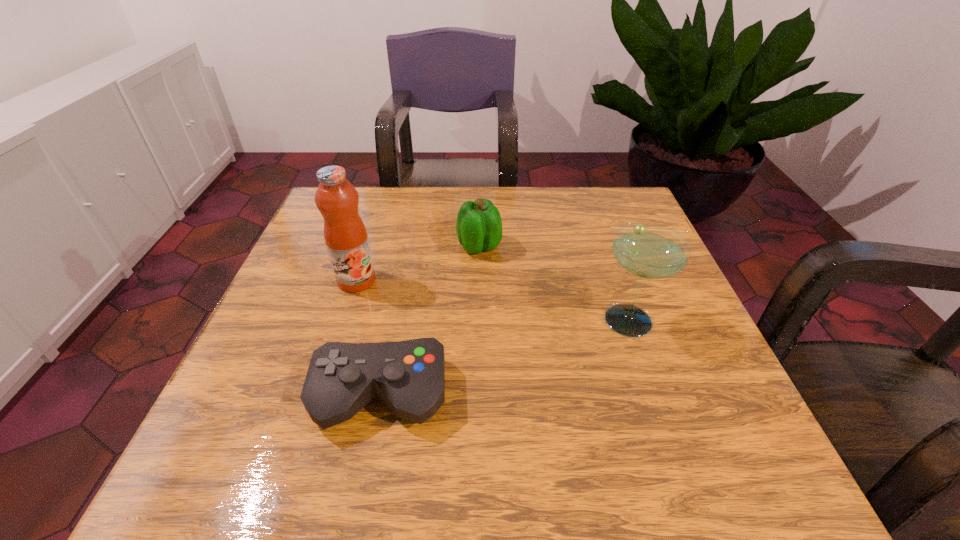
I want to click on free space at the left edge of the desktop, so click(x=299, y=341).

The width and height of the screenshot is (960, 540). Find the location of `vacant space at the right edge of the desktop`. vacant space at the right edge of the desktop is located at coordinates (654, 294).

Identify the location of free location at the far right corner of the desktop. (605, 228).

Find the location of `vacant space at the near right corner`. vacant space at the near right corner is located at coordinates (666, 472).

In order to click on empty location between the martini and the second shortest object in this screenshot , I will do `click(556, 283)`.

The image size is (960, 540). In order to click on unoccupied area between the second shortest object and the martini in this screenshot , I will do `click(556, 283)`.

Where is `empty space that is in between the third shortest object and the tallest object`? The width and height of the screenshot is (960, 540). empty space that is in between the third shortest object and the tallest object is located at coordinates (494, 300).

The image size is (960, 540). Identify the location of free area in between the shortest object and the tallest object. (369, 338).

I want to click on vacant point located between the farthest object and the nearest object, so click(430, 320).

At what (x,y) coordinates should I click in order to perform the action: click on empty location between the fruit juice and the third farthest object. Please return your answer as a coordinate pair (x, y). Looking at the image, I should click on (494, 300).